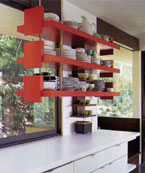
Locate an element on the screen. white wall is located at coordinates (65, 107).